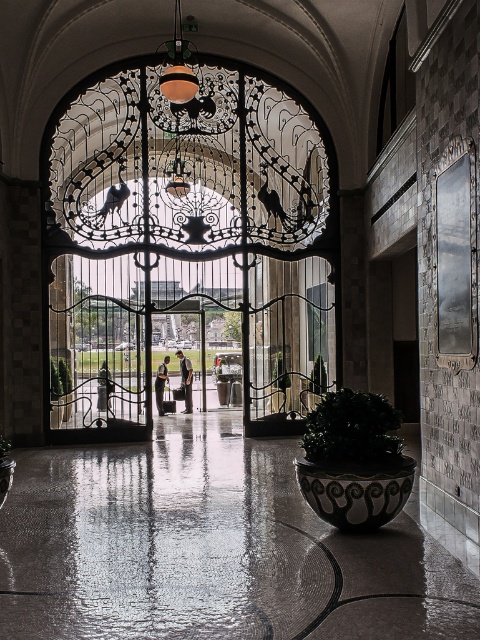
Which of these two, shiny concrete floor at center or dark green leafy plant at lower center, stands taller?

dark green leafy plant at lower center is taller.

Where is `shiny concrete floor at center`? The width and height of the screenshot is (480, 640). shiny concrete floor at center is located at coordinates (208, 548).

Between shiny concrete floor at center and green leafy plant at center, which one is positioned higher?

green leafy plant at center is above.

Is point (219, 524) in front of point (54, 380)?

That is True.

Where is `shiny concrete floor at center`? shiny concrete floor at center is located at coordinates (208, 548).

Who is taller, polished metal gate at center or shiny concrete floor at center?

With more height is polished metal gate at center.

Can you confirm if polished metal gate at center is taller than shiny concrete floor at center?

Correct, polished metal gate at center is much taller as shiny concrete floor at center.

Does point (96, 90) come farther from viewer compared to point (416, 593)?

That is True.

Locate an element on the screen. The height and width of the screenshot is (640, 480). polished metal gate at center is located at coordinates (189, 246).